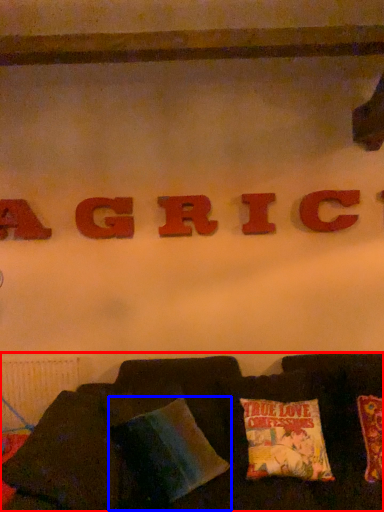
Question: Which of the following is the closest to the observer, furniture (highlighted by a red box) or pillow (highlighted by a blue box)?

Choices:
 (A) furniture
 (B) pillow

Answer: (A)